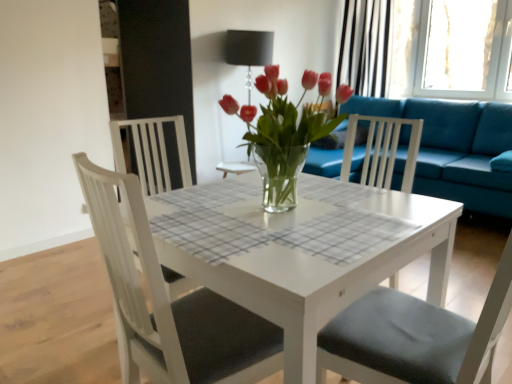
Question: Does black striped curtain at upper right have a lesser height compared to white glossy table at center?

Choices:
 (A) no
 (B) yes

Answer: (A)

Question: Can you confirm if black striped curtain at upper right is smaller than white glossy table at center?

Choices:
 (A) no
 (B) yes

Answer: (B)

Question: Is black striped curtain at upper right outside white glossy table at center?

Choices:
 (A) no
 (B) yes

Answer: (B)

Question: Considering the relative sizes of black striped curtain at upper right and white glossy table at center in the image provided, is black striped curtain at upper right bigger than white glossy table at center?

Choices:
 (A) yes
 (B) no

Answer: (B)

Question: Is black striped curtain at upper right aimed at white glossy table at center?

Choices:
 (A) no
 (B) yes

Answer: (A)

Question: Is black striped curtain at upper right inside or outside of teal fabric couch at right?

Choices:
 (A) outside
 (B) inside

Answer: (A)

Question: In the image, is black striped curtain at upper right positioned in front of or behind teal fabric couch at right?

Choices:
 (A) front
 (B) behind

Answer: (B)

Question: Based on their sizes in the image, would you say black striped curtain at upper right is bigger or smaller than teal fabric couch at right?

Choices:
 (A) big
 (B) small

Answer: (B)

Question: From the image's perspective, is black striped curtain at upper right above or below teal fabric couch at right?

Choices:
 (A) above
 (B) below

Answer: (A)

Question: Considering the positions of matte black lampshade at center and black striped curtain at upper right in the image, is matte black lampshade at center wider or thinner than black striped curtain at upper right?

Choices:
 (A) wide
 (B) thin

Answer: (A)

Question: From the image's perspective, is matte black lampshade at center positioned above or below black striped curtain at upper right?

Choices:
 (A) below
 (B) above

Answer: (A)

Question: From their relative heights in the image, would you say matte black lampshade at center is taller or shorter than black striped curtain at upper right?

Choices:
 (A) short
 (B) tall

Answer: (B)

Question: In the image, is matte black lampshade at center positioned in front of or behind black striped curtain at upper right?

Choices:
 (A) behind
 (B) front

Answer: (B)

Question: From a real-world perspective, is transparent glass window at upper right positioned above or below matte black lampshade at center?

Choices:
 (A) below
 (B) above

Answer: (B)

Question: Is transparent glass window at upper right bigger or smaller than matte black lampshade at center?

Choices:
 (A) small
 (B) big

Answer: (A)